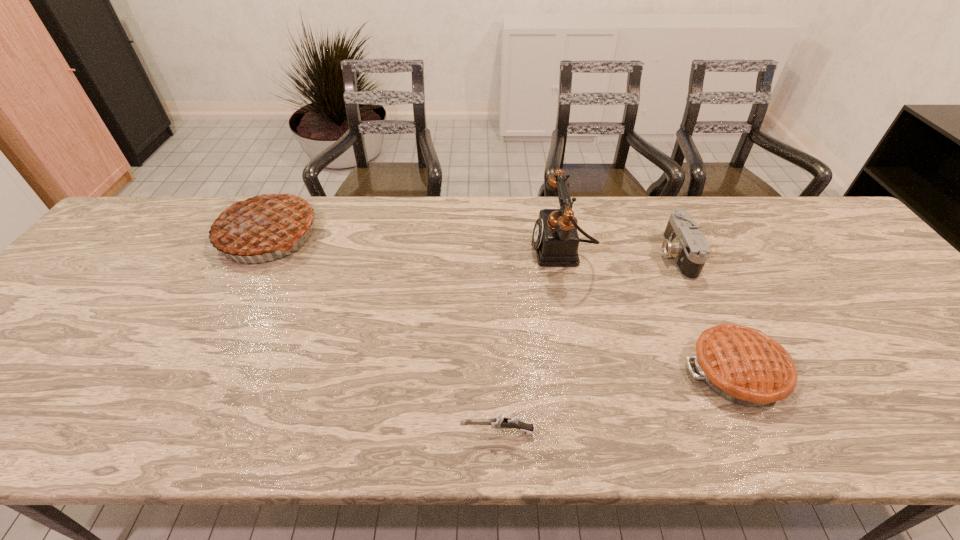
In order to click on free space between the third object from left to right and the leftmost object in this screenshot , I will do 415,242.

Image resolution: width=960 pixels, height=540 pixels. What are the coordinates of `free space that is in between the taller pie and the second object from left to right` in the screenshot? It's located at (383, 333).

Locate an element on the screen. This screenshot has width=960, height=540. vacant space that is in between the taller pie and the nearer pie is located at coordinates (502, 302).

Find the location of a particular element. This screenshot has height=540, width=960. empty space that is in between the leftmost object and the nearest object is located at coordinates (383, 333).

This screenshot has height=540, width=960. Identify the location of empty space between the fourth object from right to left and the camera. (587, 343).

Where is `empty location between the third object from left to right and the taller pie`? The width and height of the screenshot is (960, 540). empty location between the third object from left to right and the taller pie is located at coordinates (415, 242).

Where is `free space between the gun and the taller pie`? The width and height of the screenshot is (960, 540). free space between the gun and the taller pie is located at coordinates (383, 333).

Locate an element on the screen. vacant region between the leftmost object and the telephone is located at coordinates (415, 242).

This screenshot has width=960, height=540. Find the location of `object that can be found as the fourth closest to the right pie`. object that can be found as the fourth closest to the right pie is located at coordinates (261, 223).

In order to click on object that is the third closest to the shorter pie in this screenshot , I will do `click(499, 422)`.